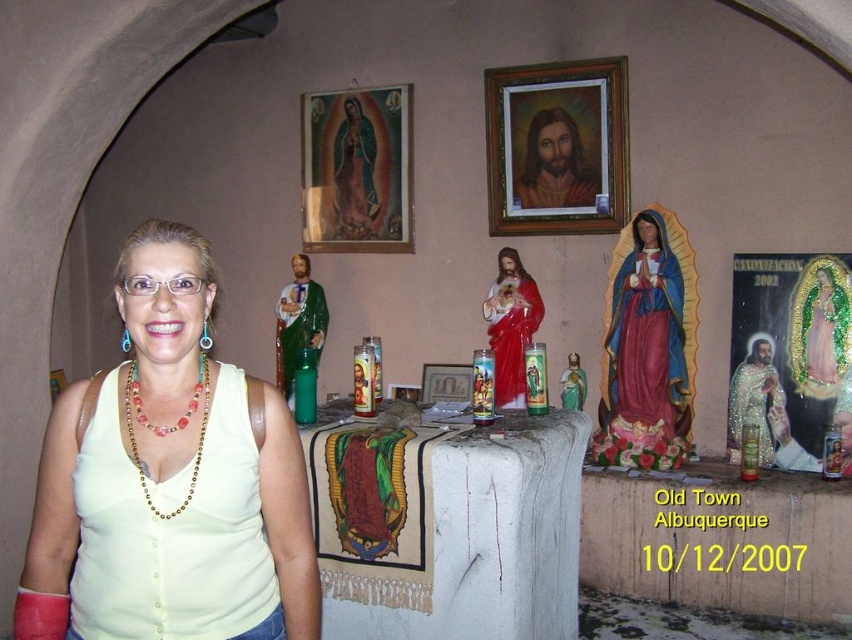
Does matte red statue at center lie in front of matte gold jesus at upper center?

Yes, matte red statue at center is in front of matte gold jesus at upper center.

Who is shorter, matte red statue at center or matte gold jesus at upper center?

Standing shorter between the two is matte gold jesus at upper center.

Between point (504, 285) and point (556, 202), which one is positioned in front?

Point (504, 285) is in front.

Identify the location of matte red statue at center. (511, 324).

Can you confirm if matte plastic statue at right is positioned above pink glossy statue at upper center?

Yes, matte plastic statue at right is above pink glossy statue at upper center.

Is point (630, 330) positioned before point (832, 275)?

No, it is behind (832, 275).

You are a GUI agent. You are given a task and a screenshot of the screen. Output one action in this format:
    pyautogui.click(x=<x>, y=<y>)
    Task: Click on the matte plastic statue at right
    
    Given the screenshot: What is the action you would take?
    pyautogui.click(x=645, y=333)

Is yellow fabric top at center smaller than matte gold jesus at upper center?

No.

Does yellow fabric top at center have a lesser width compared to matte gold jesus at upper center?

In fact, yellow fabric top at center might be wider than matte gold jesus at upper center.

Where is `yellow fabric top at center`? This screenshot has height=640, width=852. yellow fabric top at center is located at coordinates (170, 481).